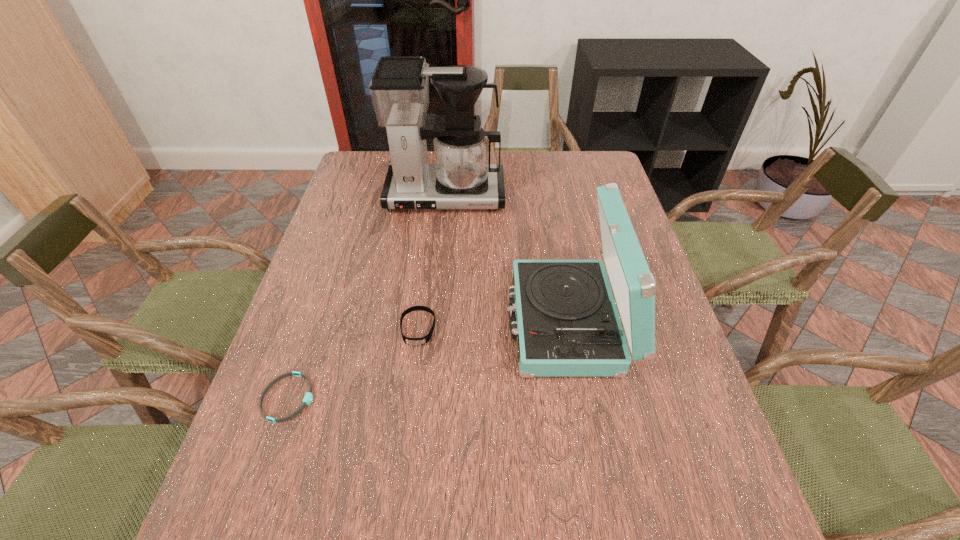
Identify the location of blank space at the right edge of the desktop. (655, 409).

Find the location of a particular element. This screenshot has height=540, width=960. vacant space at the near left corner is located at coordinates (205, 539).

At what (x,y) coordinates should I click in order to perform the action: click on vacant space at the far right corner. Please return your answer as a coordinate pair (x, y). This screenshot has height=540, width=960. Looking at the image, I should click on (602, 152).

Find the location of a particular element. Image resolution: width=960 pixels, height=540 pixels. free area in between the farther wristband and the shortest object is located at coordinates (353, 363).

The width and height of the screenshot is (960, 540). In order to click on vacant area that lies between the shortest object and the tallest object in this screenshot , I will do `click(367, 297)`.

Find the location of a particular element. free space between the second shortest object and the coffee maker is located at coordinates (431, 262).

Where is `vacant area between the taller wristband and the third shortest object`? The image size is (960, 540). vacant area between the taller wristband and the third shortest object is located at coordinates (493, 325).

The height and width of the screenshot is (540, 960). In order to click on vacant area that lies between the second shortest object and the farthest object in this screenshot , I will do `click(431, 262)`.

Where is `blank region between the shortest object and the second tallest object`? blank region between the shortest object and the second tallest object is located at coordinates (428, 360).

Locate an element on the screen. unoccupied position between the third shortest object and the tallest object is located at coordinates (507, 259).